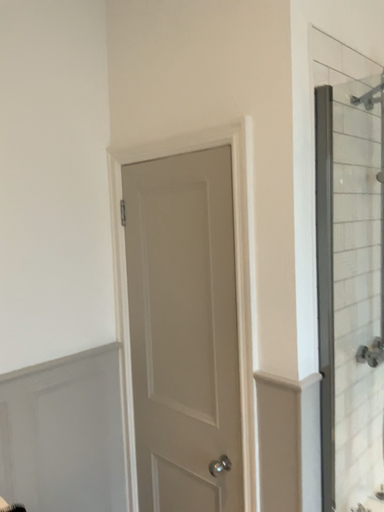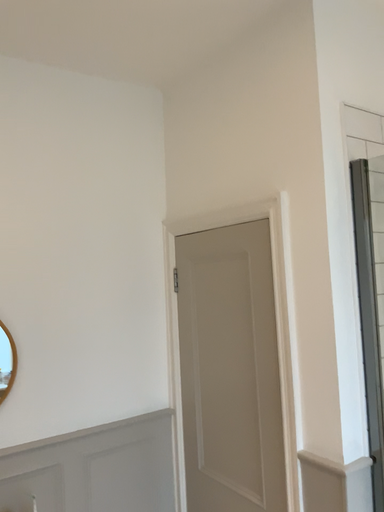
Question: Which way did the camera rotate in the video?

Choices:
 (A) rotated left
 (B) rotated right

Answer: (A)